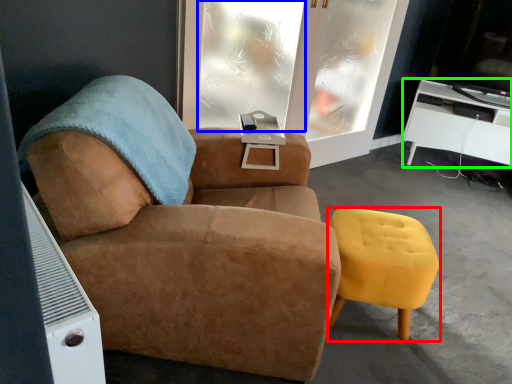
Question: Which is farther away from stool (highlighted by a red box)? window (highlighted by a blue box) or desk (highlighted by a green box)?

Choices:
 (A) window
 (B) desk

Answer: (B)